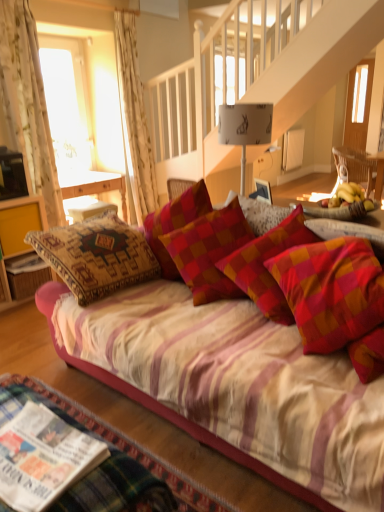
Question: Considering the positions of point (374, 176) and point (119, 320), is point (374, 176) closer or farther from the camera than point (119, 320)?

Choices:
 (A) farther
 (B) closer

Answer: (A)

Question: Is wooden chair at right bigger or smaller than silky pink couch at center?

Choices:
 (A) big
 (B) small

Answer: (B)

Question: Considering the real-world distances, which object is farthest from the pink fabric bed frame at lower left?

Choices:
 (A) white floral fabric curtain at left, which is counted as the second curtain, starting from the right
 (B) printed paper magazine at lower left, arranged as the 2th magazine when viewed from the top
 (C) white floral fabric curtain at upper left, the first curtain when ordered from back to front
 (D) wooden chair at right
 (E) white paper lampshade at upper center

Answer: (C)

Question: Which is farther from the white floral fabric curtain at left, the first curtain viewed from the front?

Choices:
 (A) white floral fabric curtain at upper left, the second curtain viewed from the left
 (B) printed paper magazine at lower left, arranged as the 2th magazine when viewed from the top
 (C) white glossy magazine at lower left, the first magazine from the top
 (D) pink fabric bed frame at lower left
 (E) wooden chair at right

Answer: (E)